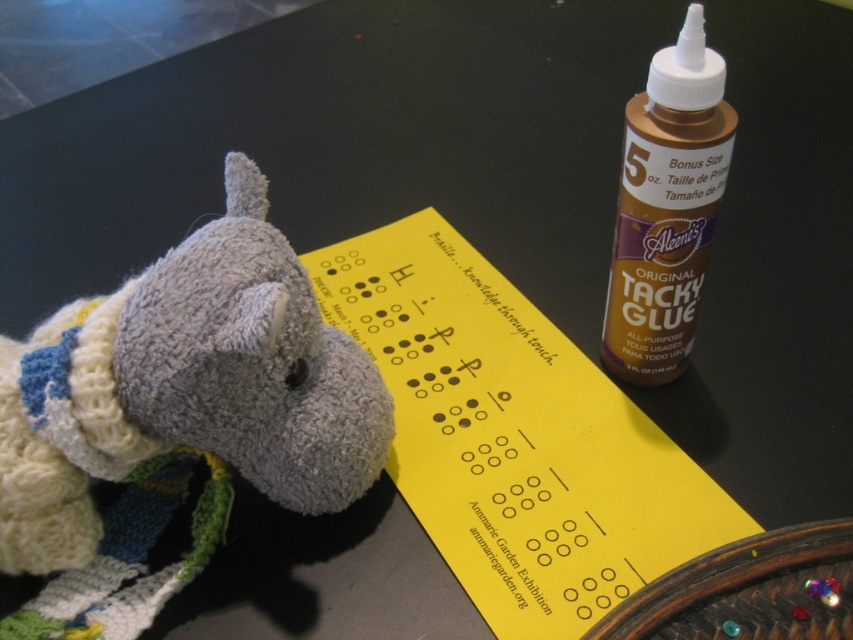
Question: In this image, where is knitted gray horse at lower left located relative to brown matte glue at upper right?

Choices:
 (A) above
 (B) below

Answer: (B)

Question: Can you confirm if knitted gray horse at lower left is positioned below brown matte glue at upper right?

Choices:
 (A) yes
 (B) no

Answer: (A)

Question: Which point appears farthest from the camera in this image?

Choices:
 (A) (142, 394)
 (B) (666, 285)

Answer: (B)

Question: Which point appears closest to the camera in this image?

Choices:
 (A) (248, 268)
 (B) (657, 211)

Answer: (A)

Question: Which point is farther to the camera?

Choices:
 (A) (637, 330)
 (B) (151, 348)

Answer: (A)

Question: Can you confirm if knitted gray horse at lower left is bigger than brown matte glue at upper right?

Choices:
 (A) no
 (B) yes

Answer: (B)